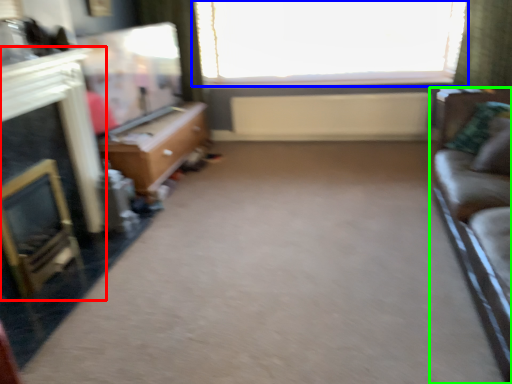
Question: Estimate the real-world distances between objects in this image. Which object is farther from fireplace (highlighted by a red box), window (highlighted by a blue box) or studio couch (highlighted by a green box)?

Choices:
 (A) window
 (B) studio couch

Answer: (A)